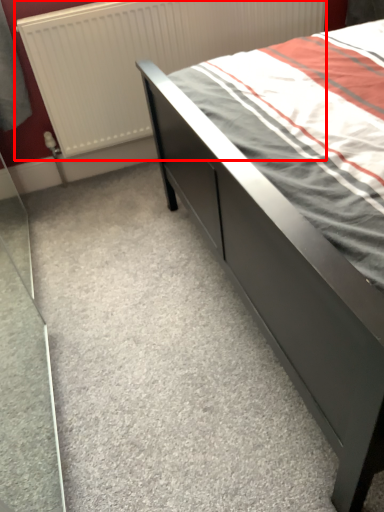
Question: From the image's perspective, what is the correct spatial positioning of radiator (annotated by the red box) in reference to bed?

Choices:
 (A) above
 (B) below

Answer: (A)